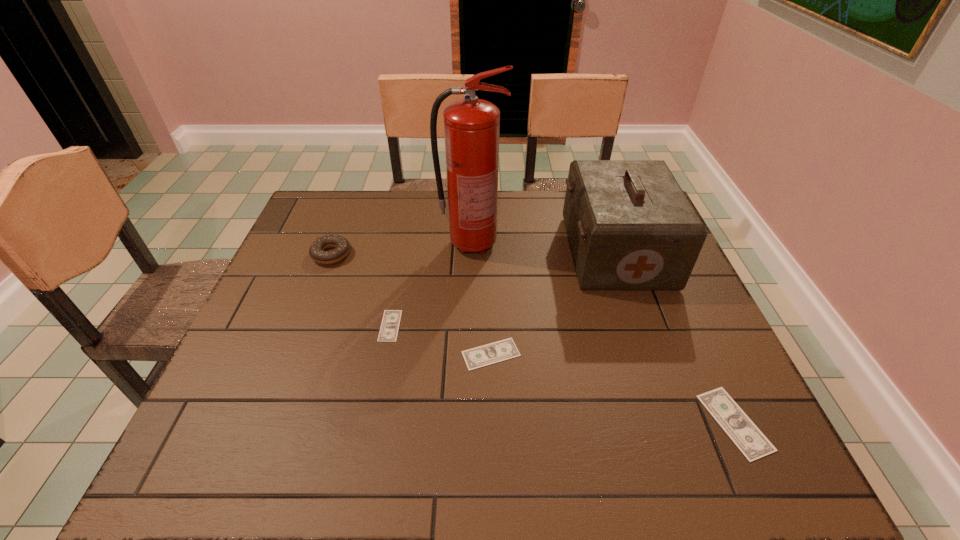
Identify the location of money that is at the right edge. This screenshot has height=540, width=960. (752, 443).

What are the coordinates of `the first-aid kit located in the right edge section of the desktop` in the screenshot? It's located at [630, 226].

The height and width of the screenshot is (540, 960). I want to click on object present at the far right corner, so click(x=630, y=226).

The height and width of the screenshot is (540, 960). Identify the location of object situated at the near right corner. (752, 443).

This screenshot has height=540, width=960. I want to click on free spot at the far edge of the desktop, so click(521, 212).

Locate an element on the screen. The height and width of the screenshot is (540, 960). vacant space at the near edge is located at coordinates pos(614,390).

Where is `free space at the left edge`? The image size is (960, 540). free space at the left edge is located at coordinates (254, 317).

This screenshot has height=540, width=960. Identify the location of free space at the right edge. tap(652, 298).

The image size is (960, 540). In order to click on vacant region at the near left corner of the desktop in this screenshot , I will do `click(236, 407)`.

The image size is (960, 540). What are the coordinates of `free spot at the near right corner of the desktop` in the screenshot? It's located at (751, 407).